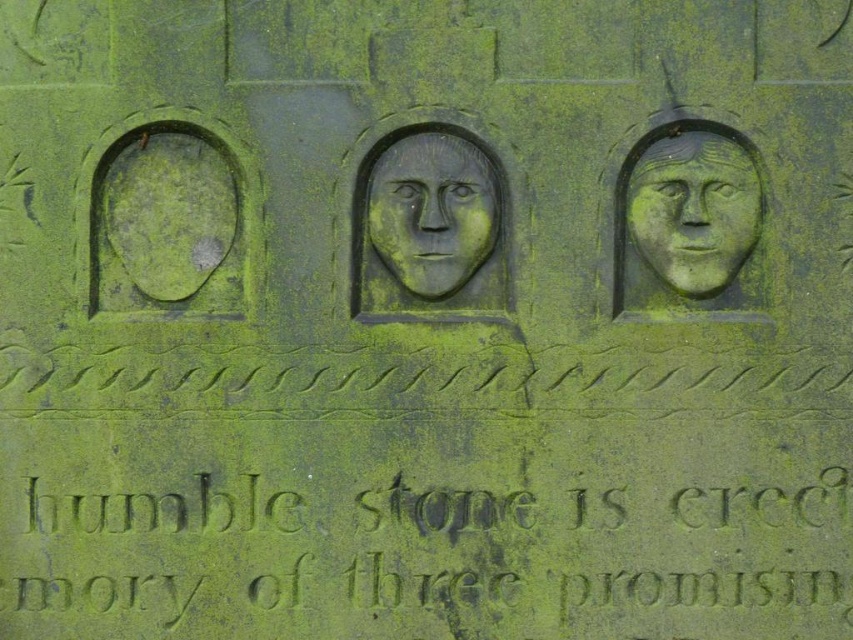
Looking at this image, you are an archaeologist examining the stone monument. You notice two carvings on it. The green stone carving at center and the gray stone face at center. Which one is located to the right of the other?

The green stone carving at center is positioned on the right side of gray stone face at center.

You are an archaeologist examining the stone monument. You notice the green stone engraving at center and the gray stone face at center. Which of these two features is taller?

The gray stone face at center is taller than the green stone engraving at center.